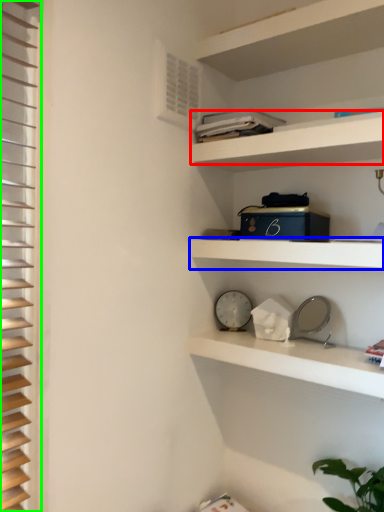
Question: Estimate the real-world distances between objects in this image. Which object is farther from cabinet (highlighted by a red box), shelf (highlighted by a blue box) or shutter (highlighted by a green box)?

Choices:
 (A) shelf
 (B) shutter

Answer: (B)